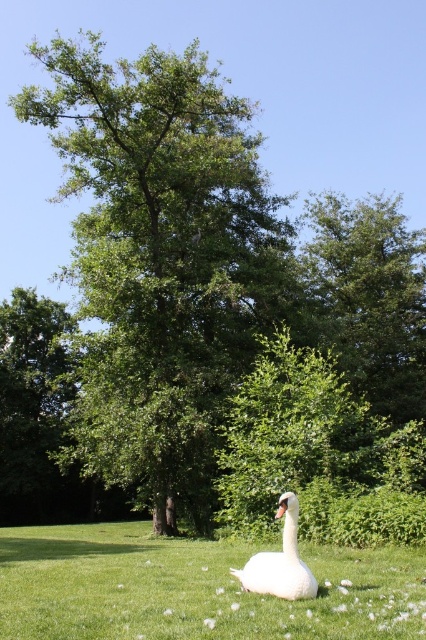
Question: Is green leafy tree at center above white glossy swan at center?

Choices:
 (A) yes
 (B) no

Answer: (A)

Question: Which point is closer to the camera?

Choices:
 (A) white feathered swan at center
 (B) green leafy tree at center

Answer: (A)

Question: Which of the following is the closest to the observer?

Choices:
 (A) (103, 577)
 (B) (160, 400)
 (C) (282, 512)

Answer: (C)

Question: Is white feathered swan at center positioned behind white glossy swan at center?

Choices:
 (A) no
 (B) yes

Answer: (A)

Question: Considering the real-world distances, which object is farthest from the white glossy swan at center?

Choices:
 (A) white feathered swan at center
 (B) green leafy tree at center

Answer: (B)

Question: Where is green leafy tree at center located in relation to white glossy swan at center in the image?

Choices:
 (A) above
 (B) below

Answer: (A)